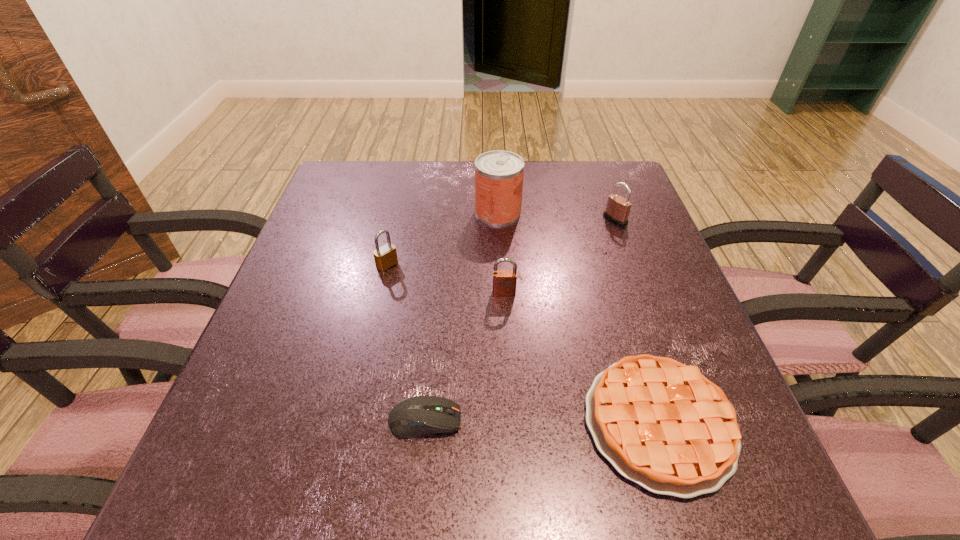
Find the location of a particular element. This screenshot has height=540, width=960. the closest padlock to the leftmost object is located at coordinates (504, 281).

You are a GUI agent. You are given a task and a screenshot of the screen. Output one action in this format:
    pyautogui.click(x=<x>, y=<y>)
    Task: Click on the vacant point that satisfies the following two spatial constraints: 1. on the front-facing side of the pie; 2. on the right side of the nearest padlock
    The width and height of the screenshot is (960, 540).
    Given the screenshot: What is the action you would take?
    pyautogui.click(x=511, y=423)

Where is `blank area in the image that satisfies the following two spatial constraints: 1. on the back side of the rightmost padlock; 2. on the right side of the leftmost object`? blank area in the image that satisfies the following two spatial constraints: 1. on the back side of the rightmost padlock; 2. on the right side of the leftmost object is located at coordinates (397, 220).

Where is `free space that satisfies the following two spatial constraints: 1. on the back side of the rightmost padlock; 2. on the left side of the fourth nearest object`? free space that satisfies the following two spatial constraints: 1. on the back side of the rightmost padlock; 2. on the left side of the fourth nearest object is located at coordinates (397, 220).

Image resolution: width=960 pixels, height=540 pixels. Identify the location of free point that satisfies the following two spatial constraints: 1. on the button of the fifth object from right to left; 2. on the right side of the pie. (424, 423).

This screenshot has height=540, width=960. Identify the location of vacant region that satisfies the following two spatial constraints: 1. on the front-facing side of the pie; 2. on the left side of the second padlock from right to left. (511, 423).

Where is `vacant area that satisfies the following two spatial constraints: 1. on the front-facing side of the third nearest object; 2. on the left side of the pie`? Image resolution: width=960 pixels, height=540 pixels. vacant area that satisfies the following two spatial constraints: 1. on the front-facing side of the third nearest object; 2. on the left side of the pie is located at coordinates tap(511, 423).